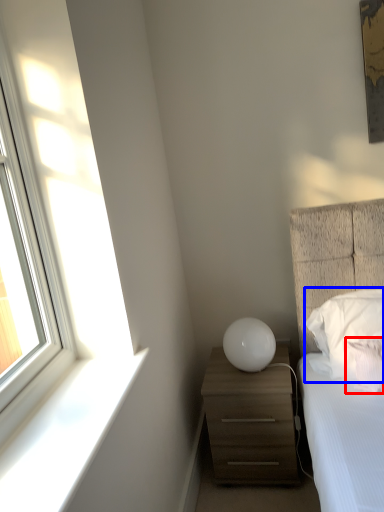
Question: Among these objects, which one is farthest to the camera, pillow (highlighted by a red box) or pillow (highlighted by a blue box)?

Choices:
 (A) pillow
 (B) pillow

Answer: (B)